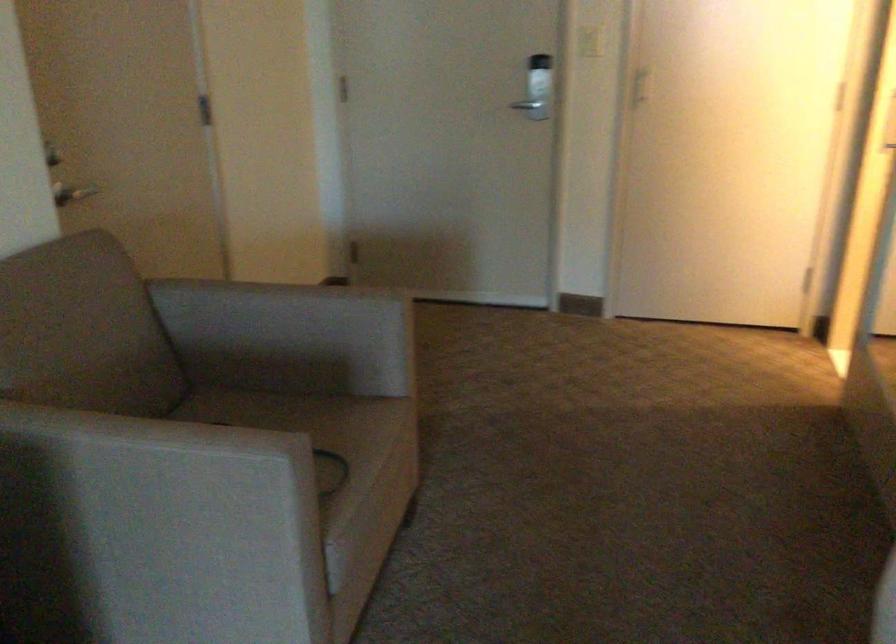
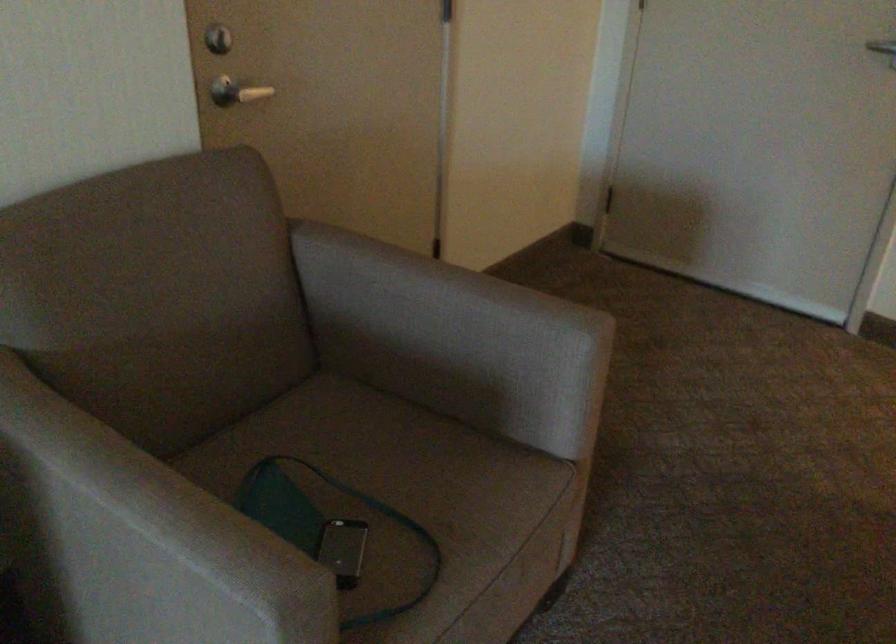
Locate, in the second image, the point that corresponds to pixel 176 451 in the first image.

(150, 538)